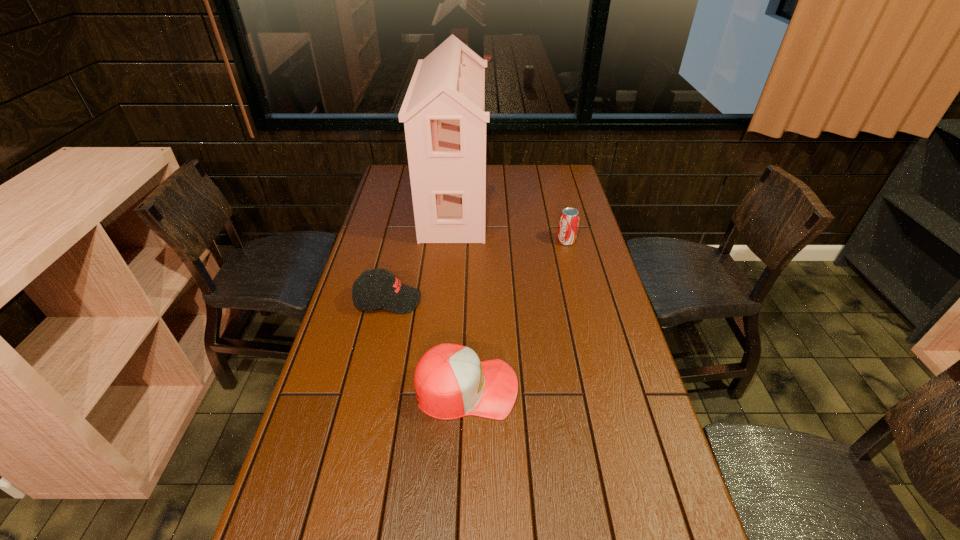
Identify the location of the tallest object. (443, 112).

The width and height of the screenshot is (960, 540). What are the coordinates of `the rightmost object` in the screenshot? It's located at (569, 218).

You are a GUI agent. You are given a task and a screenshot of the screen. Output one action in this format:
    pyautogui.click(x=<x>, y=<y>)
    Task: Click on the nearer baseball cap
    
    Given the screenshot: What is the action you would take?
    pyautogui.click(x=450, y=381)

This screenshot has height=540, width=960. Identify the location of the nearest object. (450, 381).

Find the location of `the second nearest object`. the second nearest object is located at coordinates (369, 293).

Where is `the farther baseball cap`? The width and height of the screenshot is (960, 540). the farther baseball cap is located at coordinates (369, 293).

The image size is (960, 540). Identify the location of free space located 0.110m on the front-facing side of the tallest object. point(514,202).

Locate an element on the screen. This screenshot has height=540, width=960. vacant space located 0.310m on the back of the soda can is located at coordinates (554, 192).

You are a GUI agent. You are given a task and a screenshot of the screen. Output one action in this format:
    pyautogui.click(x=<x>, y=<y>)
    Task: Click on the free space located on the front-facing side of the right baseball cap
    Image resolution: width=960 pixels, height=540 pixels.
    Given the screenshot: What is the action you would take?
    pyautogui.click(x=615, y=388)

Locate an element on the screen. vacant area situated 0.330m on the front-facing side of the left baseball cap is located at coordinates (528, 300).